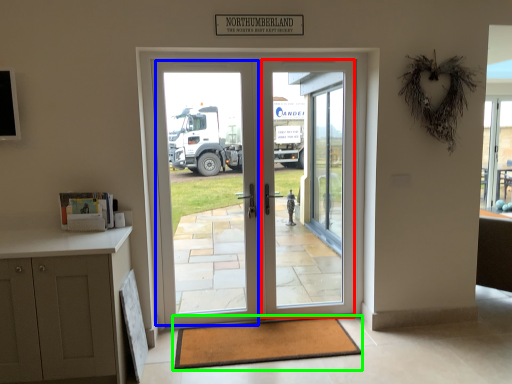
Question: Based on their relative distances, which object is nearer to screen door (highlighted by a red box)? Choose from screen door (highlighted by a blue box) and mat (highlighted by a green box).

Choices:
 (A) screen door
 (B) mat

Answer: (A)